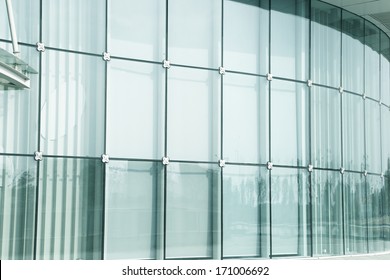
Locate an element on the screen. The image size is (390, 280). vertical blinds is located at coordinates (52, 173), (350, 203).